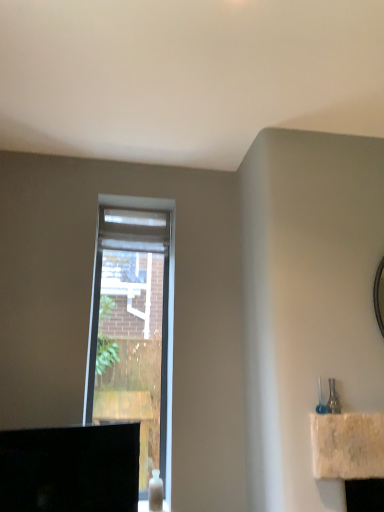
At what (x,y) coordinates should I click in order to perform the action: click on clear glass window at center. Please return your answer as a coordinate pair (x, y). Looking at the image, I should click on click(134, 325).

The height and width of the screenshot is (512, 384). What do you see at coordinates (134, 325) in the screenshot? I see `clear glass window at center` at bounding box center [134, 325].

Where is `white sheer curtain at center`? Image resolution: width=384 pixels, height=512 pixels. white sheer curtain at center is located at coordinates (134, 230).

Measure the distance between white sheer curtain at center and camera.

white sheer curtain at center and camera are 2.61 meters apart from each other.

This screenshot has height=512, width=384. What do you see at coordinates (134, 230) in the screenshot?
I see `white sheer curtain at center` at bounding box center [134, 230].

This screenshot has height=512, width=384. I want to click on clear glass window at center, so click(134, 325).

Considering the positions of objects clear glass window at center and white sheer curtain at center in the image provided, who is more to the right, clear glass window at center or white sheer curtain at center?

From the viewer's perspective, white sheer curtain at center appears more on the right side.

Which is behind, clear glass window at center or white sheer curtain at center?

white sheer curtain at center is behind.

Considering the points (132, 280) and (153, 233), which point is in front, point (132, 280) or point (153, 233)?

Point (132, 280)

From the image's perspective, is clear glass window at center above or below white sheer curtain at center?

Based on their image positions, clear glass window at center is located beneath white sheer curtain at center.

From a real-world perspective, is clear glass window at center positioned above or below white sheer curtain at center?

clear glass window at center is situated lower than white sheer curtain at center in the real world.

Looking at their sizes, would you say clear glass window at center is wider or thinner than white sheer curtain at center?

clear glass window at center is thinner than white sheer curtain at center.

Looking at this image, from their relative heights in the image, would you say clear glass window at center is taller or shorter than white sheer curtain at center?

clear glass window at center is taller than white sheer curtain at center.

Considering the sizes of objects clear glass window at center and white sheer curtain at center in the image provided, who is smaller, clear glass window at center or white sheer curtain at center?

white sheer curtain at center is smaller.

Is clear glass window at center not inside white sheer curtain at center?

Indeed, clear glass window at center is completely outside white sheer curtain at center.

Is clear glass window at center far away from white sheer curtain at center?

No, clear glass window at center is not far away from white sheer curtain at center.

Is clear glass window at center oriented away from white sheer curtain at center?

No, clear glass window at center's orientation is not away from white sheer curtain at center.

Where is `curtain above the clear glass window at center (from a real-world perspective)`? Image resolution: width=384 pixels, height=512 pixels. curtain above the clear glass window at center (from a real-world perspective) is located at coordinates (134, 230).

In the image, is white sheer curtain at center on the left side or the right side of clear glass window at center?

In the image, white sheer curtain at center appears on the right side of clear glass window at center.

Relative to clear glass window at center, is white sheer curtain at center in front or behind?

In the image, white sheer curtain at center appears behind clear glass window at center.

Considering the positions of point (110, 223) and point (114, 420), is point (110, 223) closer or farther from the camera than point (114, 420)?

Clearly, point (110, 223) is more distant from the camera than point (114, 420).

From the image's perspective, is white sheer curtain at center above or below clear glass window at center?

Based on their image positions, white sheer curtain at center is located above clear glass window at center.

From a real-world perspective, relative to clear glass window at center, is white sheer curtain at center vertically above or below?

In terms of real-world spatial position, white sheer curtain at center is above clear glass window at center.

In terms of width, does white sheer curtain at center look wider or thinner when compared to clear glass window at center?

Considering their sizes, white sheer curtain at center looks broader than clear glass window at center.

Does white sheer curtain at center have a lesser height compared to clear glass window at center?

Correct, white sheer curtain at center is not as tall as clear glass window at center.

Is white sheer curtain at center bigger than clear glass window at center?

Actually, white sheer curtain at center might be smaller than clear glass window at center.

In the scene shown: Is white sheer curtain at center situated inside clear glass window at center or outside?

white sheer curtain at center exists outside the volume of clear glass window at center.

Is white sheer curtain at center next to clear glass window at center?

No, white sheer curtain at center is not making contact with clear glass window at center.

Is white sheer curtain at center oriented towards clear glass window at center?

No, white sheer curtain at center is not facing towards clear glass window at center.

You are a GUI agent. You are given a task and a screenshot of the screen. Output one action in this format:
    pyautogui.click(x=<x>, y=<y>)
    Task: Click on the window below the white sheer curtain at center (from the image's perspective)
    This screenshot has width=384, height=512.
    Given the screenshot: What is the action you would take?
    pyautogui.click(x=134, y=325)

The image size is (384, 512). I want to click on curtain behind the clear glass window at center, so click(134, 230).

The width and height of the screenshot is (384, 512). Find the location of `window located below the white sheer curtain at center (from the image's perspective)`. window located below the white sheer curtain at center (from the image's perspective) is located at coordinates (134, 325).